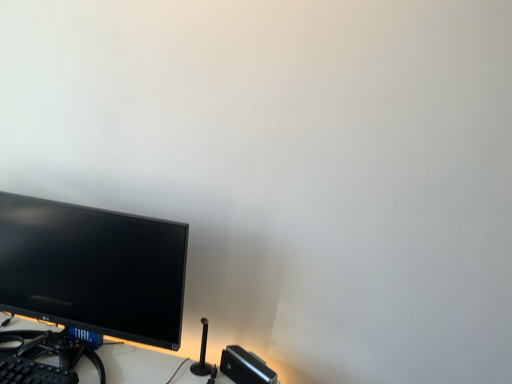
What do you see at coordinates (93, 269) in the screenshot? I see `matte black monitor at left` at bounding box center [93, 269].

Identify the location of matte black monitor at left. (93, 269).

Locate an element on the screen. black plastic keyboard at lower left is located at coordinates (33, 372).

This screenshot has height=384, width=512. What do you see at coordinates (33, 372) in the screenshot? I see `black plastic keyboard at lower left` at bounding box center [33, 372].

Where is `matte black monitor at left`? The image size is (512, 384). matte black monitor at left is located at coordinates (93, 269).

Considering the relative positions of matte black monitor at left and black plastic keyboard at lower left in the image provided, is matte black monitor at left to the right of black plastic keyboard at lower left from the viewer's perspective?

Yes, matte black monitor at left is to the right of black plastic keyboard at lower left.

Is matte black monitor at left positioned behind black plastic keyboard at lower left?

Yes.

Is point (49, 202) closer to viewer compared to point (18, 365)?

No, (49, 202) is further to viewer.

From the image's perspective, is matte black monitor at left located above or below black plastic keyboard at lower left?

Clearly, from the image's perspective, matte black monitor at left is above black plastic keyboard at lower left.

From a real-world perspective, is matte black monitor at left on black plastic keyboard at lower left?

Yes, from a real-world perspective, matte black monitor at left is on top of black plastic keyboard at lower left.

Consider the image. Considering the sizes of objects matte black monitor at left and black plastic keyboard at lower left in the image provided, who is thinner, matte black monitor at left or black plastic keyboard at lower left?

matte black monitor at left is thinner.

From their relative heights in the image, would you say matte black monitor at left is taller or shorter than black plastic keyboard at lower left?

matte black monitor at left is taller than black plastic keyboard at lower left.

Is matte black monitor at left bigger than black plastic keyboard at lower left?

Yes, matte black monitor at left is bigger than black plastic keyboard at lower left.

Do you think matte black monitor at left is within black plastic keyboard at lower left, or outside of it?

matte black monitor at left is spatially situated outside black plastic keyboard at lower left.

Is matte black monitor at left next to black plastic keyboard at lower left and touching it?

matte black monitor at left is not next to black plastic keyboard at lower left, and they're not touching.

Is matte black monitor at left facing away from black plastic keyboard at lower left?

matte black monitor at left is not turned away from black plastic keyboard at lower left.

Can you tell me how much matte black monitor at left and black plastic keyboard at lower left differ in facing direction?

1.42 degrees separate the facing orientations of matte black monitor at left and black plastic keyboard at lower left.

Find the location of `computer keyboard that appears below the matte black monitor at left (from a real-world perspective)`. computer keyboard that appears below the matte black monitor at left (from a real-world perspective) is located at coordinates (33, 372).

Considering the positions of objects black plastic keyboard at lower left and matte black monitor at left in the image provided, who is more to the left, black plastic keyboard at lower left or matte black monitor at left?

From the viewer's perspective, black plastic keyboard at lower left appears more on the left side.

Is the position of black plastic keyboard at lower left more distant than that of matte black monitor at left?

That is False.

Considering the positions of point (58, 381) and point (116, 235), is point (58, 381) closer or farther from the camera than point (116, 235)?

Clearly, point (58, 381) is closer to the camera than point (116, 235).

From the image's perspective, which object appears higher, black plastic keyboard at lower left or matte black monitor at left?

From the image's view, matte black monitor at left is above.

From a real-world perspective, who is located lower, black plastic keyboard at lower left or matte black monitor at left?

In real-world perspective, black plastic keyboard at lower left is lower.

Looking at their sizes, would you say black plastic keyboard at lower left is wider or thinner than matte black monitor at left?

black plastic keyboard at lower left is wider than matte black monitor at left.

Who is shorter, black plastic keyboard at lower left or matte black monitor at left?

black plastic keyboard at lower left.

Can you confirm if black plastic keyboard at lower left is smaller than matte black monitor at left?

Yes.

Do you think black plastic keyboard at lower left is within matte black monitor at left, or outside of it?

black plastic keyboard at lower left is located beyond the bounds of matte black monitor at left.

Is black plastic keyboard at lower left positioned far away from matte black monitor at left?

No.

Based on the photo, is black plastic keyboard at lower left oriented away from matte black monitor at left?

Absolutely, black plastic keyboard at lower left is directed away from matte black monitor at left.

How many degrees apart are the facing directions of black plastic keyboard at lower left and matte black monitor at left?

They differ by 1.42 degrees in their facing directions.

In order to click on computer keyboard located underneath the matte black monitor at left (from a real-world perspective) in this screenshot , I will do `click(33, 372)`.

Identify the location of computer keyboard below the matte black monitor at left (from a real-world perspective). (33, 372).

Locate an element on the screen. computer monitor positioned vertically above the black plastic keyboard at lower left (from a real-world perspective) is located at coordinates (93, 269).